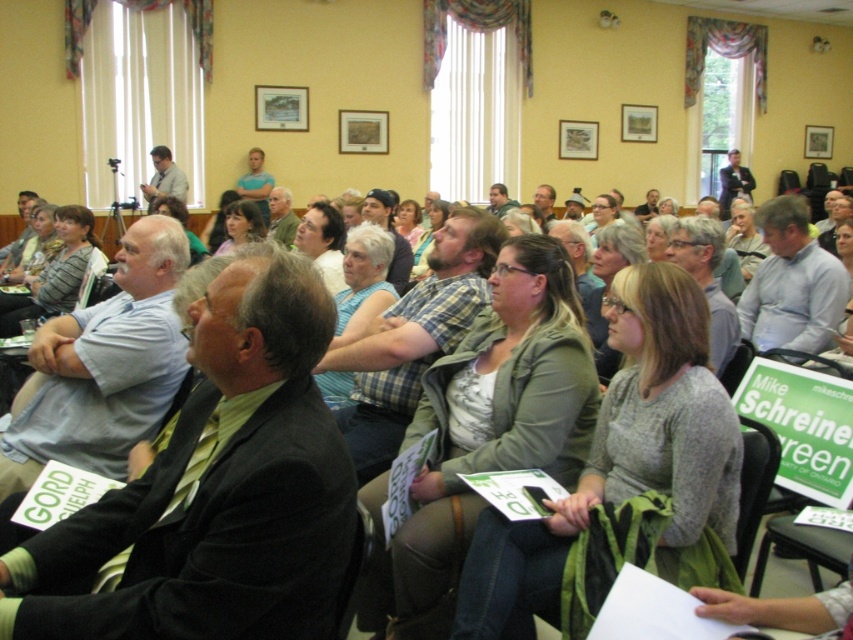
Question: Which of the following is the farthest from the observer?

Choices:
 (A) green fabric shirt at center
 (B) green fabric jacket at center
 (C) black suit at center
 (D) matte black hair at center

Answer: (A)

Question: Considering the relative positions of white shirt at center and light gray shirt at center in the image provided, where is white shirt at center located with respect to light gray shirt at center?

Choices:
 (A) below
 (B) above

Answer: (A)

Question: Which point appears closest to the camera in this image?

Choices:
 (A) (363, 260)
 (B) (35, 289)

Answer: (A)

Question: Is white shirt at center below matte green sweater at center?

Choices:
 (A) no
 (B) yes

Answer: (B)

Question: Is light blue shirt at center to the right of light gray shirt at center from the viewer's perspective?

Choices:
 (A) no
 (B) yes

Answer: (B)

Question: Which point appears closest to the camera in this image?

Choices:
 (A) (260, 180)
 (B) (62, 296)

Answer: (B)